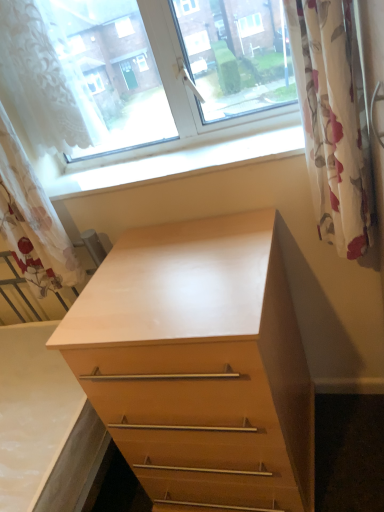
Identify the location of blank space above light wood chest of drawers at center (from a real-world perspective). The width and height of the screenshot is (384, 512). (170, 270).